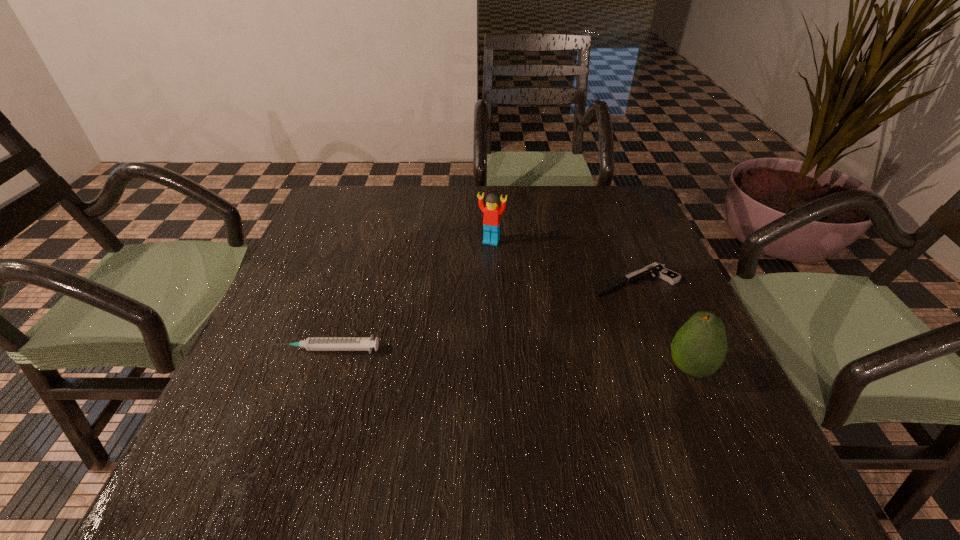
Find the location of `the leftmost object`. the leftmost object is located at coordinates (311, 343).

Find the location of a particular element. syringe is located at coordinates (311, 343).

This screenshot has width=960, height=540. I want to click on avocado, so click(x=699, y=348).

Find the location of a particular element. The width and height of the screenshot is (960, 540). Lego is located at coordinates (491, 221).

Locate an element on the screen. The height and width of the screenshot is (540, 960). the third object from right to left is located at coordinates (491, 221).

What are the coordinates of `the second farthest object` in the screenshot? It's located at (657, 270).

The width and height of the screenshot is (960, 540). I want to click on the shortest object, so 657,270.

Locate an element on the screen. free space located on the left of the avocado is located at coordinates (581, 368).

Locate an element on the screen. The image size is (960, 540). vacant space located 0.200m on the face of the third object from right to left is located at coordinates (469, 298).

This screenshot has width=960, height=540. In order to click on vacant area located on the face of the third object from right to left in this screenshot , I will do `click(447, 361)`.